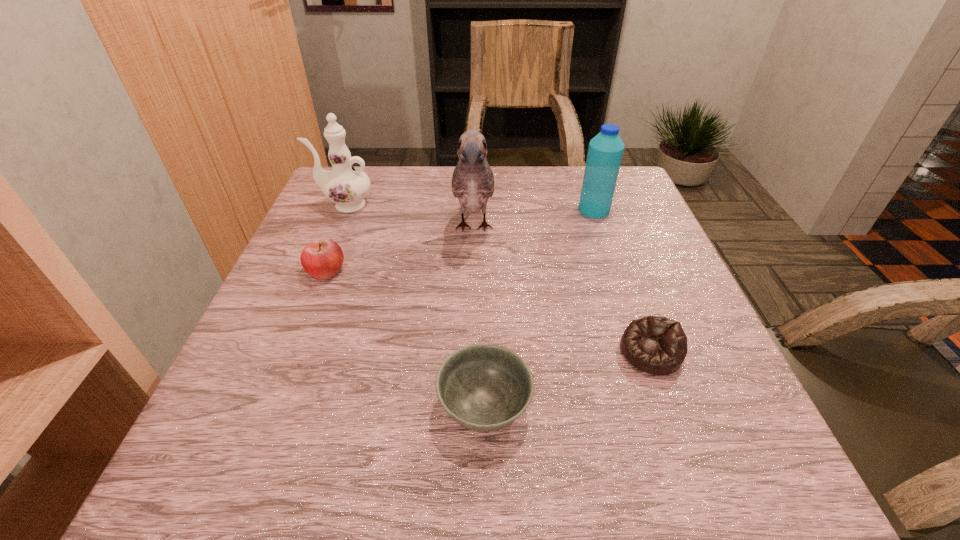
Identify the location of free spot located on the left of the beanbag. (473, 352).

Where is `parrot that is positioned at the far edge`? parrot that is positioned at the far edge is located at coordinates (473, 181).

Find the location of a particular element. This screenshot has height=540, width=960. chinaware located in the far edge section of the desktop is located at coordinates (346, 186).

Find the location of a particular element. Image resolution: width=960 pixels, height=540 pixels. water bottle that is at the far edge is located at coordinates (605, 151).

Identify the location of object located in the near edge section of the desktop. (484, 387).

Where is `chinaware that is positioned at the left edge`? The width and height of the screenshot is (960, 540). chinaware that is positioned at the left edge is located at coordinates (346, 186).

Locate an element on the screen. This screenshot has height=540, width=960. apple situated at the left edge is located at coordinates (322, 259).

The image size is (960, 540). Identify the location of water bottle located at the right edge. (605, 151).

In order to click on beanbag situated at the right edge in this screenshot , I will do `click(656, 345)`.

The image size is (960, 540). What are the coordinates of `object present at the far left corner` in the screenshot? It's located at (346, 186).